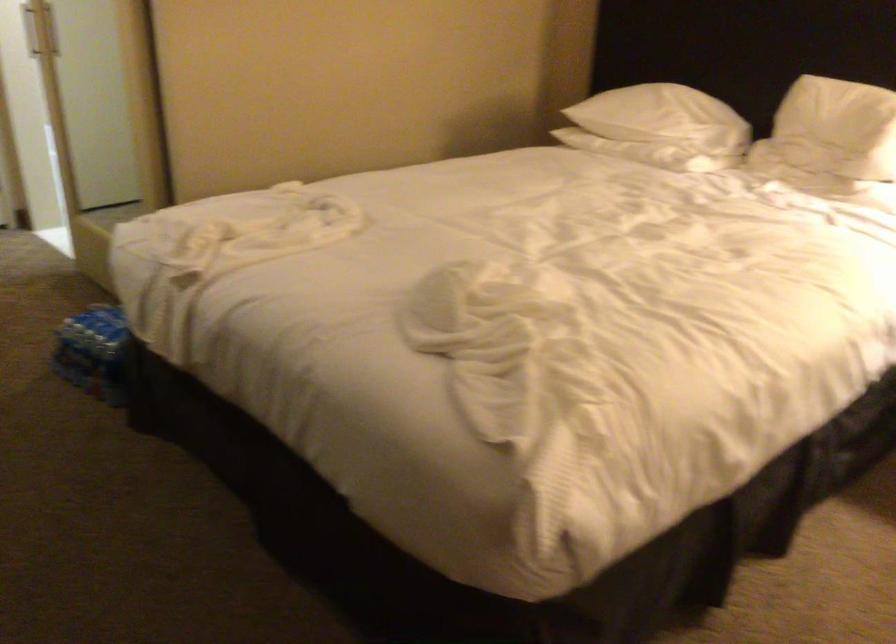
At what (x,y) coordinates should I click in order to perform the action: click on plastic water bottle. Please return your answer as a coordinate pair (x, y). The height and width of the screenshot is (644, 896). Looking at the image, I should click on (97, 354).